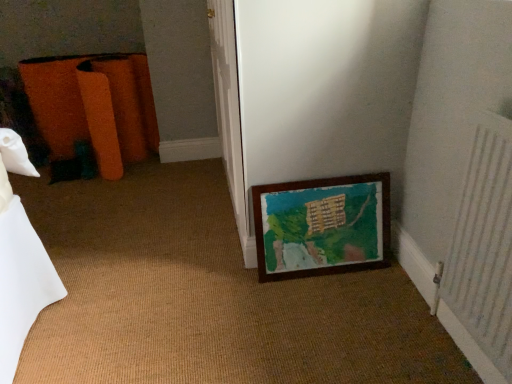
Question: Is white textured radiator at right far from orange fabric bag at left?

Choices:
 (A) yes
 (B) no

Answer: (A)

Question: Is white textured radiator at right wider than orange fabric bag at left?

Choices:
 (A) yes
 (B) no

Answer: (B)

Question: Is white textured radiator at right not within orange fabric bag at left?

Choices:
 (A) yes
 (B) no

Answer: (A)

Question: Can you confirm if white textured radiator at right is shorter than orange fabric bag at left?

Choices:
 (A) yes
 (B) no

Answer: (B)

Question: Is white textured radiator at right surrounding orange fabric bag at left?

Choices:
 (A) yes
 (B) no

Answer: (B)

Question: Is white textured radiator at right smaller than orange fabric bag at left?

Choices:
 (A) no
 (B) yes

Answer: (B)

Question: Is wooden frame at lower right taller than orange fabric bag at left?

Choices:
 (A) no
 (B) yes

Answer: (A)

Question: Is wooden frame at lower right touching orange fabric bag at left?

Choices:
 (A) yes
 (B) no

Answer: (B)

Question: From the image's perspective, is wooden frame at lower right over orange fabric bag at left?

Choices:
 (A) yes
 (B) no

Answer: (B)

Question: From a real-world perspective, is wooden frame at lower right over orange fabric bag at left?

Choices:
 (A) yes
 (B) no

Answer: (B)

Question: Is wooden frame at lower right thinner than orange fabric bag at left?

Choices:
 (A) yes
 (B) no

Answer: (A)

Question: Does wooden frame at lower right turn towards orange fabric bag at left?

Choices:
 (A) no
 (B) yes

Answer: (A)

Question: Is orange fabric bag at left thinner than white textured radiator at right?

Choices:
 (A) no
 (B) yes

Answer: (A)